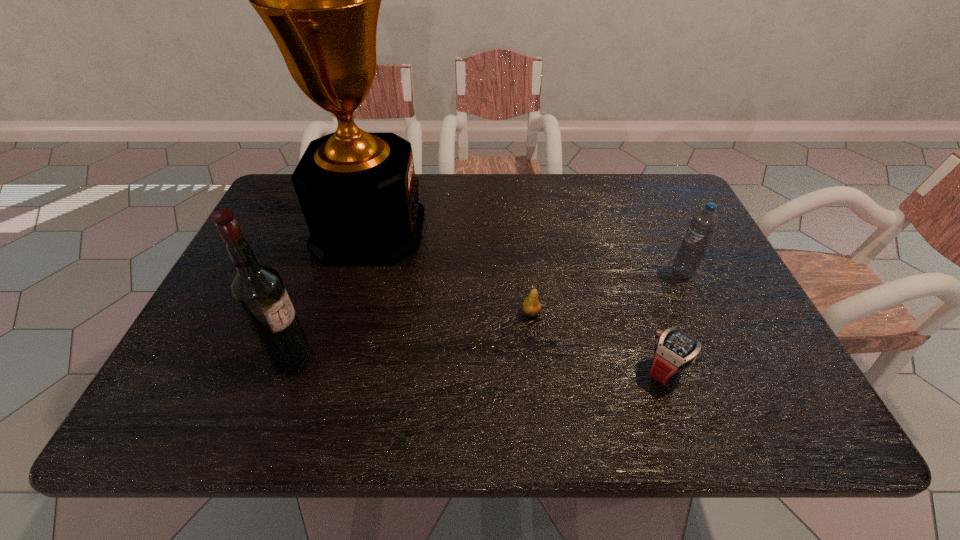
At what (x,y) coordinates should I click in order to perform the action: click on free region that satisfies the following two spatial constraints: 1. on the front of the trophy cup with the label; 2. on the back side of the water bottle. Please return your answer as a coordinate pair (x, y). Image resolution: width=960 pixels, height=540 pixels. Looking at the image, I should click on (358, 272).